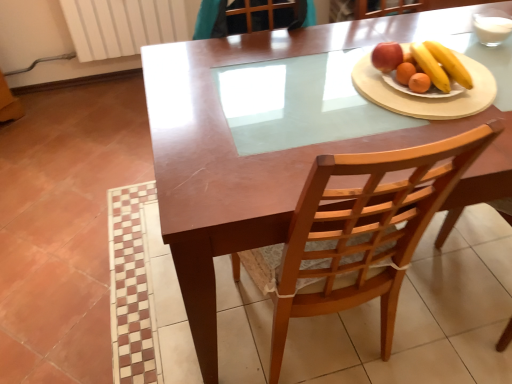
This screenshot has width=512, height=384. Identify the location of free spot in front of smooth wooden plate with fruits at right. (433, 120).